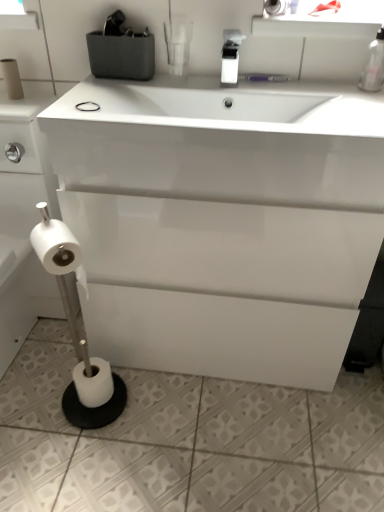
Where is `free space between white glossy cabinet at center and white matte toilet paper at lower left, marked as the third toilet paper in a left-to-right arrangement`? This screenshot has width=384, height=512. free space between white glossy cabinet at center and white matte toilet paper at lower left, marked as the third toilet paper in a left-to-right arrangement is located at coordinates (195, 395).